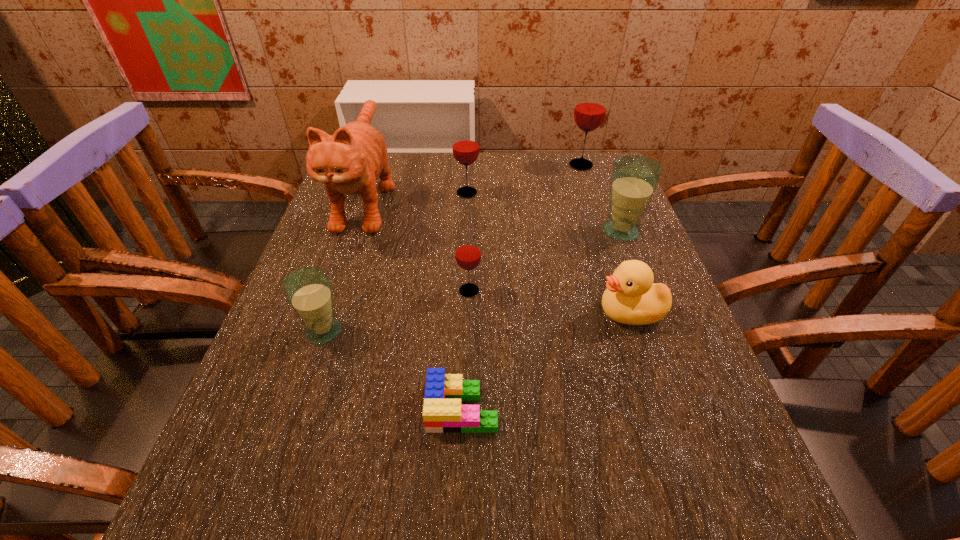
You are a GUI agent. You are given a task and a screenshot of the screen. Output one action in this format:
    pyautogui.click(x=<x>, y=<y>)
    Task: Click on the object at the far right corner
    Image resolution: width=960 pixels, height=540 pixels.
    Given the screenshot: What is the action you would take?
    pyautogui.click(x=590, y=108)

I want to click on vacant region at the far edge, so click(521, 173).

I want to click on vacant space at the left edge of the desktop, so click(275, 349).

In the image, there is a desktop. Identify the location of vacant region at the right edge. (594, 286).

The width and height of the screenshot is (960, 540). In the image, there is a desktop. Find the location of `vacant space at the far left corner`. vacant space at the far left corner is located at coordinates (390, 163).

Where is `vacant space that's between the yellow duck and the second biggest red glass`? vacant space that's between the yellow duck and the second biggest red glass is located at coordinates [548, 253].

In order to click on free space that is in between the green Lego and the smaller blue glass in this screenshot , I will do `click(393, 370)`.

I want to click on free space between the ginger cat and the biggest red glass, so click(x=473, y=181).

Image resolution: width=960 pixels, height=540 pixels. I want to click on unoccupied position between the fourth farthest glass and the rightmost red glass, so click(525, 228).

At what (x,y) coordinates should I click in order to perform the action: click on free space that is in between the smallest red glass and the ginger cat. Please return your answer as a coordinate pair (x, y). The width and height of the screenshot is (960, 540). Looking at the image, I should click on (418, 244).